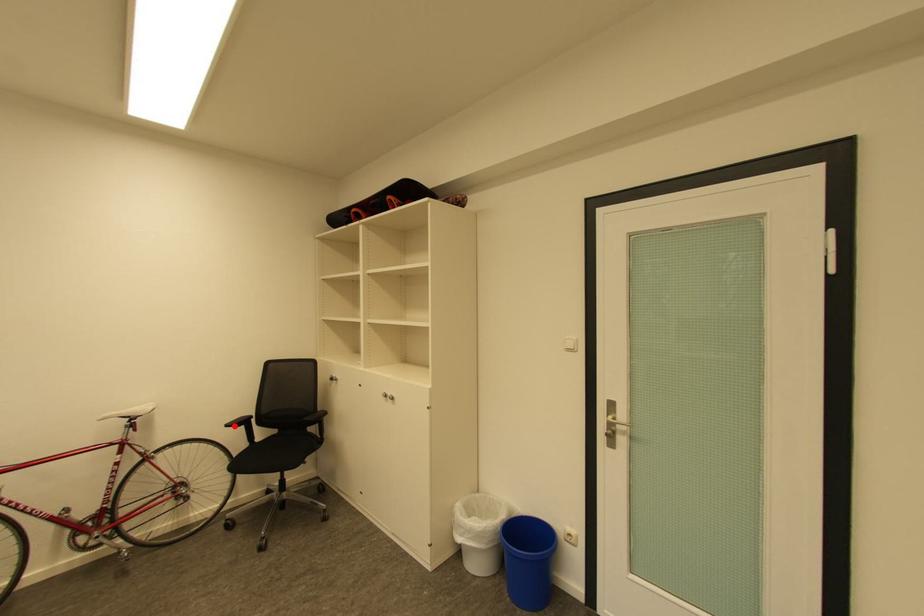
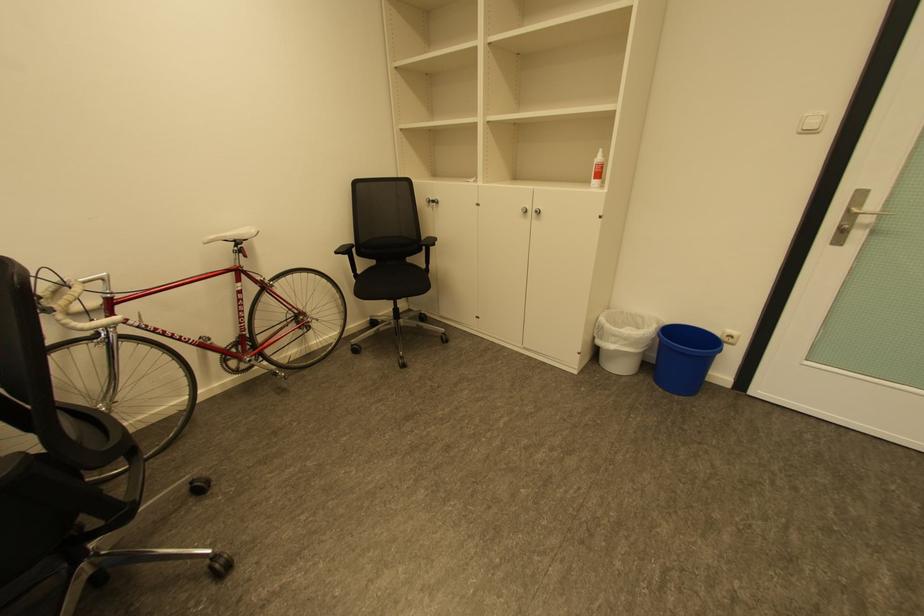
Find the pixel in the second image that matches the highlighted location in the first image.

(344, 253)